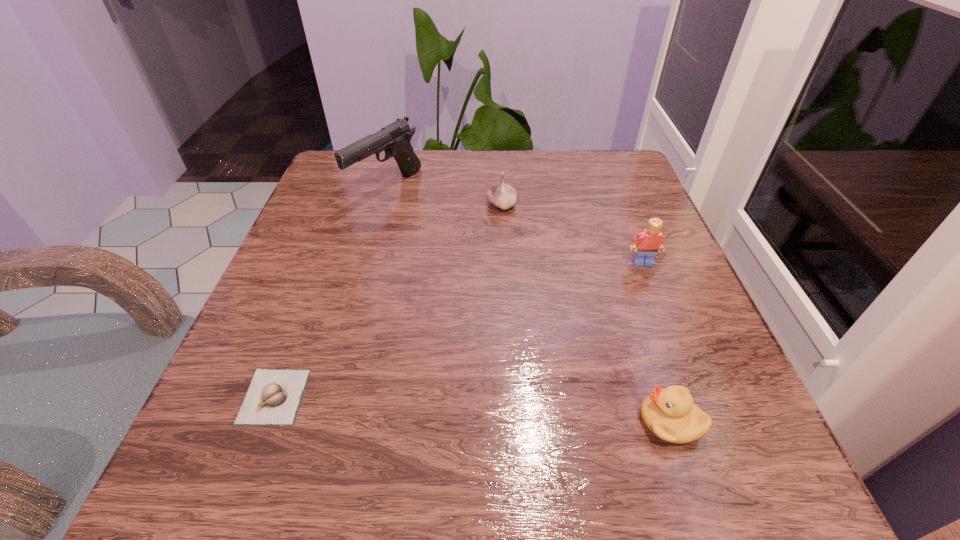
The width and height of the screenshot is (960, 540). What are the coordinates of `free spot between the left garlic and the tallest object` in the screenshot? It's located at (330, 292).

The width and height of the screenshot is (960, 540). I want to click on object that is the second nearest to the third farthest object, so click(670, 414).

Identify the location of object that stands as the third closest to the tallest object. (649, 241).